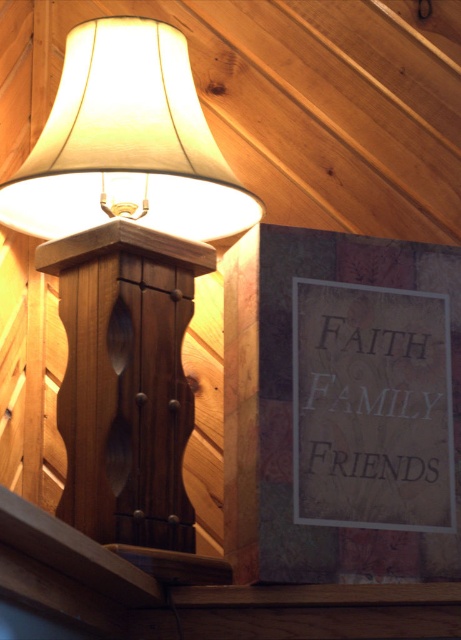
Is wooden table lamp at upper left to the right of white paper sign at upper right from the viewer's perspective?

In fact, wooden table lamp at upper left is to the left of white paper sign at upper right.

Does wooden table lamp at upper left appear over white paper sign at upper right?

Yes.

At what (x,y) coordinates should I click in order to perform the action: click on wooden table lamp at upper left. Please return your answer as a coordinate pair (x, y). Looking at the image, I should click on (126, 268).

Is wooden table lamp at upper left thinner than wooden carved pillar at upper left?

In fact, wooden table lamp at upper left might be wider than wooden carved pillar at upper left.

Who is more forward, (59, 83) or (141, 339)?

Point (141, 339)

Does point (137, 44) lie behind point (98, 259)?

Yes.

The width and height of the screenshot is (461, 640). What are the coordinates of `wooden table lamp at upper left` in the screenshot? It's located at (126, 268).

Consider the image. Can you confirm if wooden carved pillar at upper left is taller than white paper sign at upper right?

Yes, wooden carved pillar at upper left is taller than white paper sign at upper right.

Does wooden carved pillar at upper left appear under white paper sign at upper right?

No.

Measure the distance between wooden carved pillar at upper left and camera.

1.64 meters

Where is `wooden carved pillar at upper left`? The width and height of the screenshot is (461, 640). wooden carved pillar at upper left is located at coordinates (125, 380).